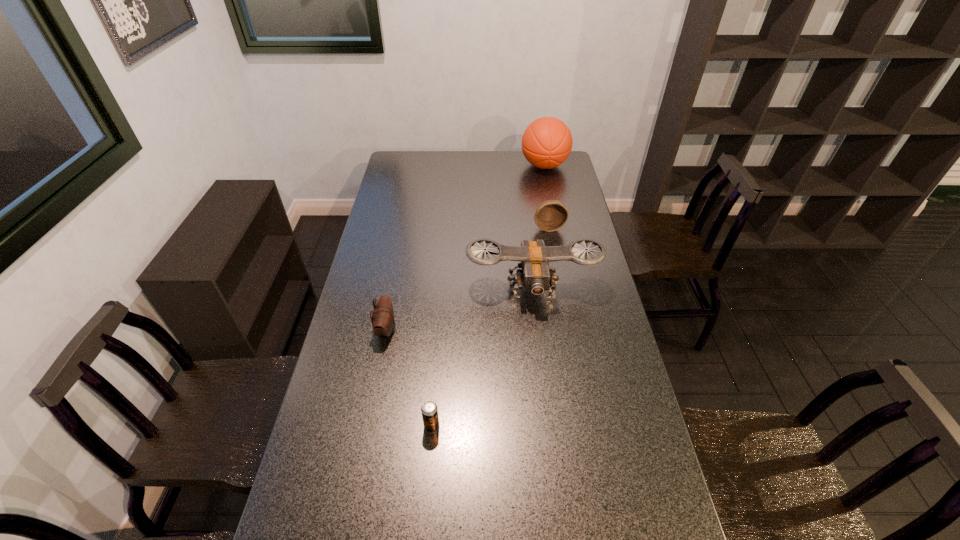
Locate an element on the screen. This screenshot has height=540, width=960. object that is at the far right corner is located at coordinates (547, 142).

You are a GUI agent. You are given a task and a screenshot of the screen. Output one action in this format:
    pyautogui.click(x=<x>, y=<y>)
    Task: Click on the vacant space at the left edge
    This screenshot has width=960, height=540.
    Given the screenshot: What is the action you would take?
    pyautogui.click(x=408, y=235)

Identify the location of free space at the right edge of the desktop. This screenshot has width=960, height=540. (598, 343).

In the image, there is a desktop. Where is `free space at the far left corner`? Image resolution: width=960 pixels, height=540 pixels. free space at the far left corner is located at coordinates (403, 159).

This screenshot has height=540, width=960. Identify the location of vacant point located between the nearest object and the tallest object. (488, 296).

Identify the location of free spot between the bowl and the tallest object. The height and width of the screenshot is (540, 960). (546, 197).

Where is `free space between the third nearest object and the leftmost object`? Image resolution: width=960 pixels, height=540 pixels. free space between the third nearest object and the leftmost object is located at coordinates (459, 309).

In order to click on free point between the pouch and the bowl in this screenshot , I will do `click(468, 278)`.

Identify the location of unoccupied area between the second farthest object and the leftmost object. The width and height of the screenshot is (960, 540). (468, 278).

I want to click on vacant space in between the nearest object and the second farthest object, so click(x=491, y=327).